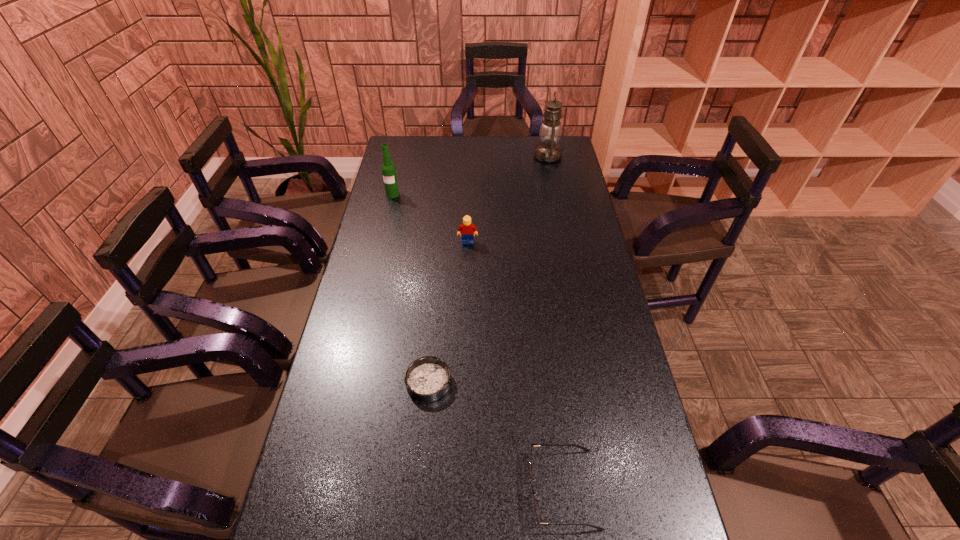
Where is `free space between the oil lamp and the third nearest object`? The width and height of the screenshot is (960, 540). free space between the oil lamp and the third nearest object is located at coordinates (508, 199).

Locate an element on the screen. The image size is (960, 540). vacant space that's between the leftmost object and the nearest object is located at coordinates (478, 342).

Identify the location of vacant area between the Lego and the spectacles. The width and height of the screenshot is (960, 540). (516, 366).

I want to click on free space between the beer bottle and the fourth tallest object, so click(x=478, y=342).

Identify the location of vacant region between the ashtray and the oil lamp. (489, 269).

What are the coordinates of `free space between the tallest object and the second tallest object` in the screenshot? It's located at (470, 176).

Identify which object is the second nearest to the ashtray. Please provide its 2D coordinates. Your answer should be formatted as a tuple, i.e. [(x, y)], where the tuple contains the x and y coordinates of a point satisfying the conditions above.

[(467, 229)]

This screenshot has width=960, height=540. Identify the location of object that is the closest one to the fourth farthest object. (583, 448).

This screenshot has height=540, width=960. In order to click on vacant space that satisfies the following two spatial constraints: 1. on the label of the fourth farthest object; 2. on the left side of the leftmost object in this screenshot , I will do 348,382.